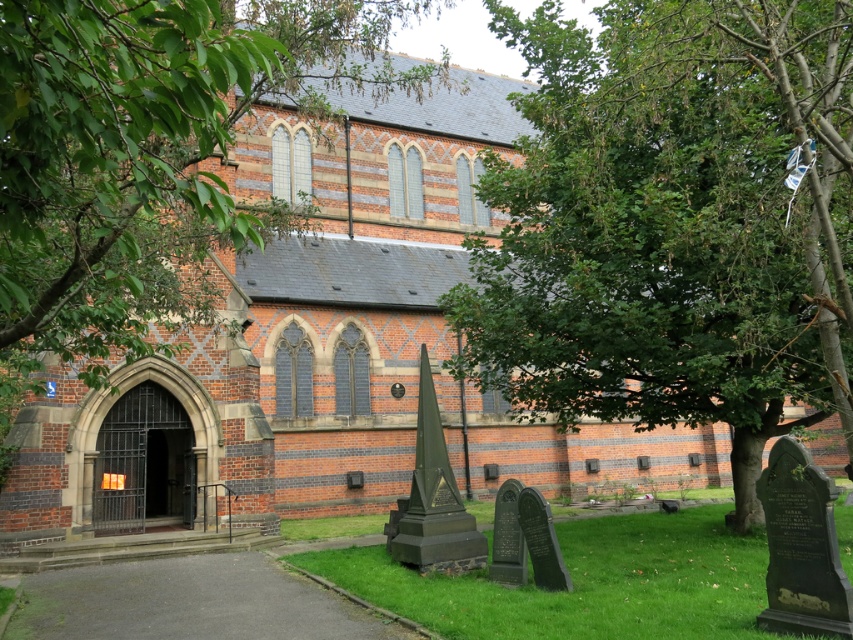
You are standing in front of the church and want to take a photo of the point at coordinates (668, 369). Your camera has a minimum focus distance of 10 meters. Will the camera be able to focus on the point?

The point at coordinates (668, 369) is 12.96 meters away from the camera, which is beyond the minimum focus distance of 10 meters. Therefore, the camera should be able to focus on the point.

You are standing in front of the church and want to find the green grass at center. Which object should you look for that is smaller than the green leafy tree at upper left?

The green grass at center is smaller than the green leafy tree at upper left, so you should look for the green grass at center.

You are standing in front of the church and notice two points marked in the scene. The first point is at coordinates point (x=264, y=92) and the second is at point (x=612, y=618). Which of these points is closer to you?

Point (x=264, y=92) is closer to you because it is further to the camera than point (x=612, y=618).